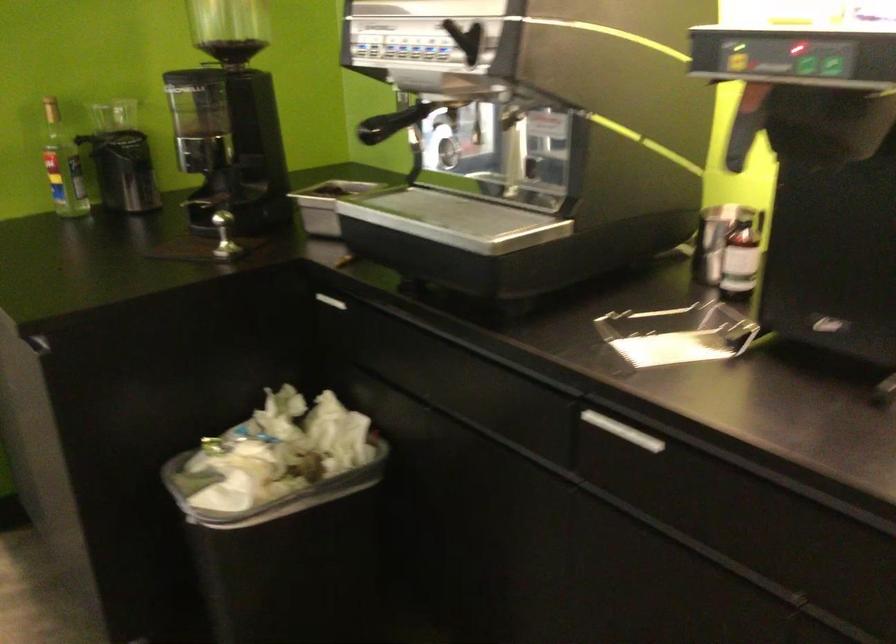
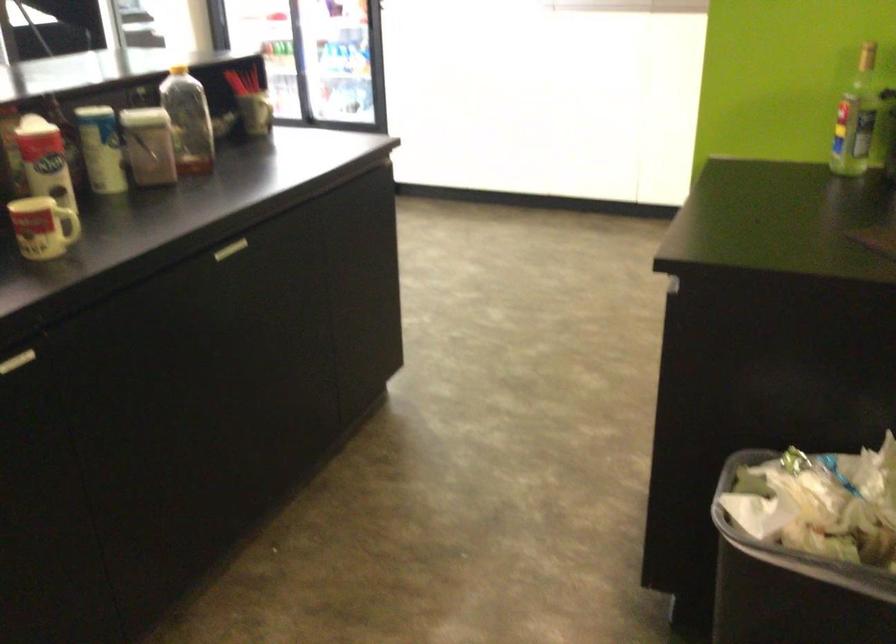
Question: The camera is either moving clockwise (left) or counter-clockwise (right) around the object. The first image is from the beginning of the video and the second image is from the end. Is the camera moving left or right when shooting the video?

Choices:
 (A) Left
 (B) Right

Answer: (B)